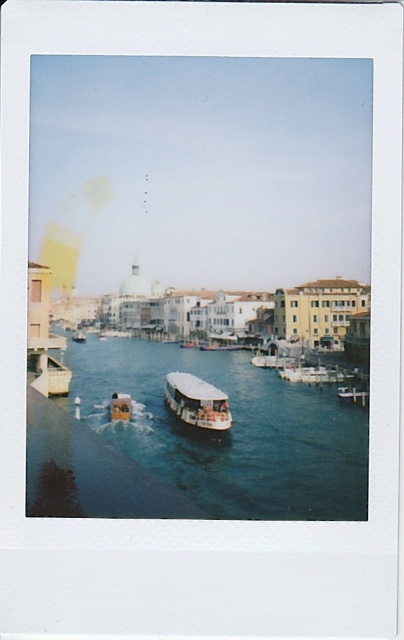
You are a tourist standing on the bridge on the left side of the canal. You want to take a photo of the white matte boat at center and the blue waterway at center. Which one will appear taller in your photo?

The blue waterway at center will appear taller in your photo because it is taller than the white matte boat at center according to the description.

You are a tour guide planning a boat tour on the canal. You need to ensure the boat can navigate safely between the bridge on the left and the buildings on the right. Given that the boat is 50 feet long, will there be enough space between the blue waterway at center and the white matte boat at center to maneuver?

The blue waterway at center is 50.44 feet from the white matte boat at center. Since the boat is 50 feet long, there is sufficient space to maneuver safely between them.